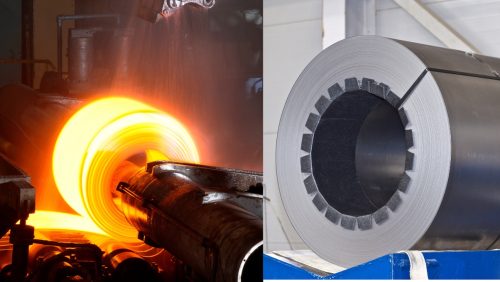
The height and width of the screenshot is (282, 500). I want to click on wall, so click(x=297, y=31).